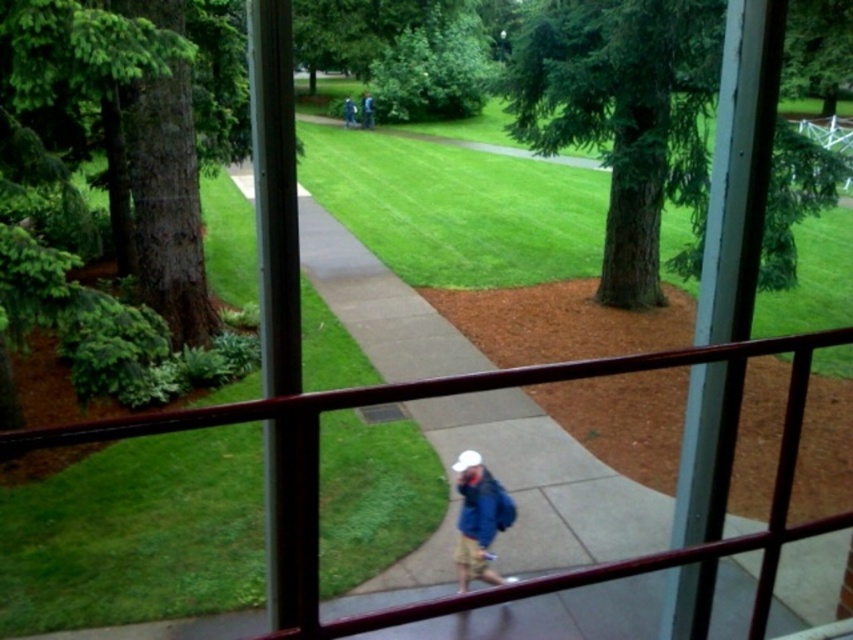
You are standing in front of the window and see two points marked on the glass. The first point is at coordinate point (526, 36) and the second is at point (463, 544). Which point is closer to you?

Point (526, 36) is further to the camera than point (463, 544), so the point closer to you is point (463, 544).

You are standing in a room looking through the window with a metal frame. You notice a point marked at coordinates (622, 115). What object does this point correspond to in the scene outside?

The point at coordinates (622, 115) corresponds to the green textured tree at center.

You are standing in a room looking through the window. There is a point marked at coordinates (622, 115) on the window frame. What object is located at that point?

The green textured tree at center is located at point (622, 115).